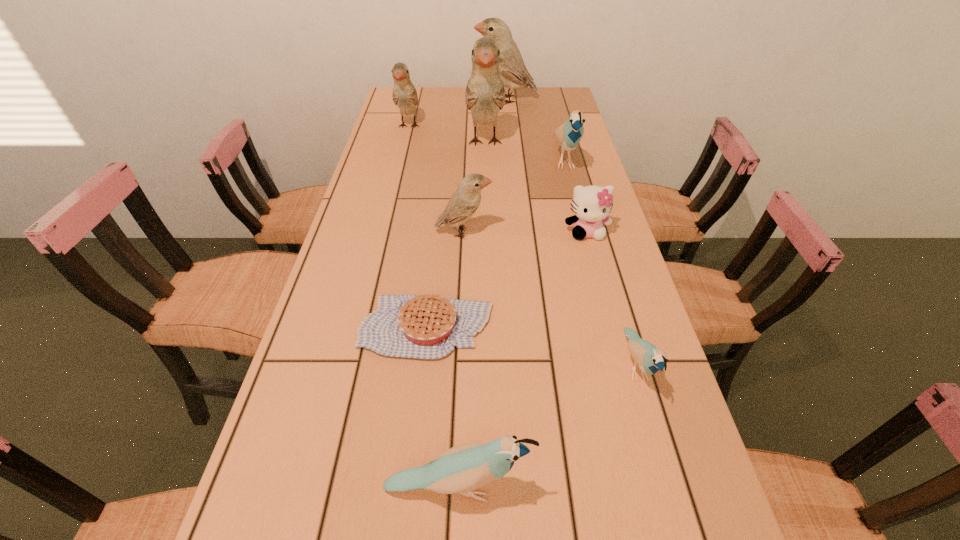
This screenshot has height=540, width=960. I want to click on kitten present at the right edge, so click(x=591, y=205).

Where is `object present at the far right corner`? The height and width of the screenshot is (540, 960). object present at the far right corner is located at coordinates (513, 72).

The image size is (960, 540). In the image, there is a desktop. What are the coordinates of `free space at the far edge` in the screenshot? It's located at 432,105.

Where is `free space at the left edge of the desktop`? free space at the left edge of the desktop is located at coordinates (398, 132).

Locate an element on the screen. free spot at the right edge of the desktop is located at coordinates (626, 361).

Identify the location of free area in between the biggest blue bird and the pie. (495, 244).

This screenshot has height=540, width=960. Find the location of `free spot between the nearest white bird and the biggest blue bird`. free spot between the nearest white bird and the biggest blue bird is located at coordinates (514, 196).

Where is `free space between the kitten and the leftmost bird`? free space between the kitten and the leftmost bird is located at coordinates (497, 179).

The width and height of the screenshot is (960, 540). I want to click on vacant region between the nearest white bird and the second smallest white bird, so click(436, 179).

You are a GUI agent. You are given a task and a screenshot of the screen. Output one action in this format:
    pyautogui.click(x=<x>, y=<y>)
    Task: Click on the free spot between the second tallest object and the smallest blue bird
    The height and width of the screenshot is (540, 960).
    Given the screenshot: What is the action you would take?
    pyautogui.click(x=570, y=233)